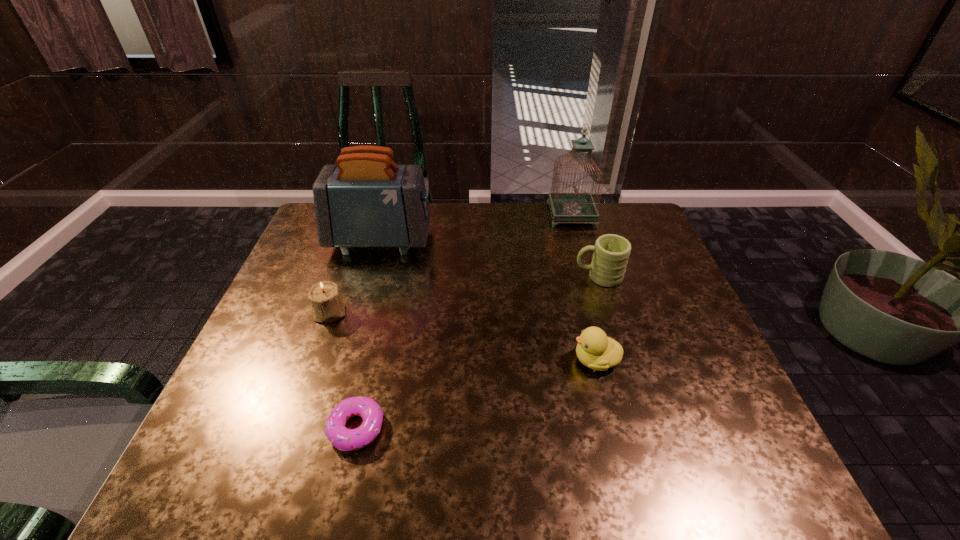
At what (x,y) coordinates should I click in order to perform the action: click on birdcage that is at the far edge. Please return your answer as a coordinate pair (x, y). The width and height of the screenshot is (960, 540). Looking at the image, I should click on (576, 207).

The height and width of the screenshot is (540, 960). I want to click on toaster positioned at the far edge, so click(364, 201).

Find the location of `object present at the near edge`. object present at the near edge is located at coordinates 341,437.

Find the location of a particular element. This screenshot has height=540, width=960. toaster located in the left edge section of the desktop is located at coordinates (364, 201).

Where is `candle_holder at the left edge`? candle_holder at the left edge is located at coordinates (326, 301).

This screenshot has width=960, height=540. In order to click on object at the right edge in this screenshot , I will do `click(611, 253)`.

Where is `object at the far left corner`? Image resolution: width=960 pixels, height=540 pixels. object at the far left corner is located at coordinates (364, 201).

The width and height of the screenshot is (960, 540). Find the location of `free location at the far edge`. free location at the far edge is located at coordinates (530, 242).

Where is `free space at the near edge`? Image resolution: width=960 pixels, height=540 pixels. free space at the near edge is located at coordinates (344, 458).

Identify the location of vacant region at the left edge of the desktop. This screenshot has width=960, height=540. (325, 253).